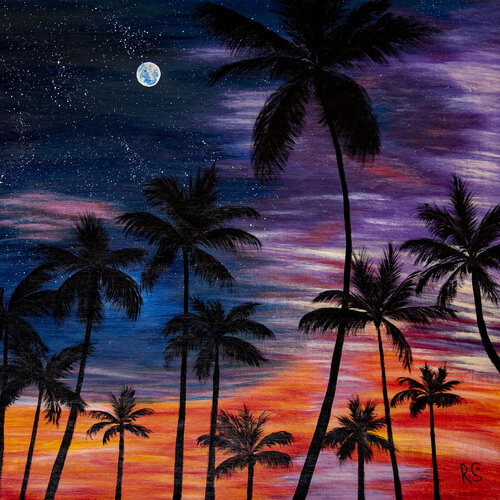
The height and width of the screenshot is (500, 500). Find the location of `right side of painting`. right side of painting is located at coordinates (488, 191).